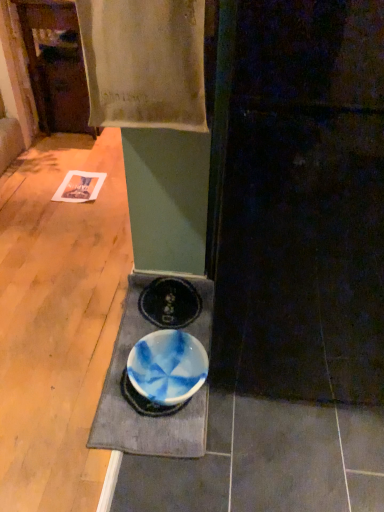
Locate an element on the screen. free space between smooth dark wood door at center and blue glossy bowl at center is located at coordinates (271, 435).